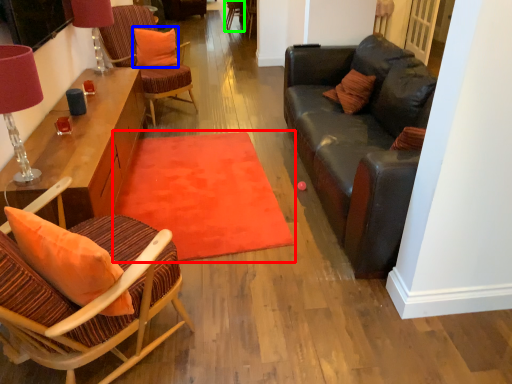
Question: Estimate the real-world distances between objects in this image. Which object is closer to mat (highlighted by a red box), pillow (highlighted by a blue box) or armchair (highlighted by a green box)?

Choices:
 (A) pillow
 (B) armchair

Answer: (A)